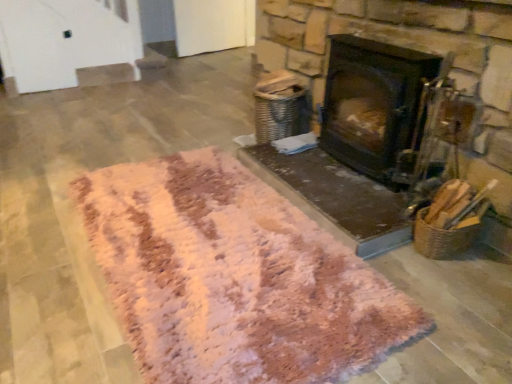
The image size is (512, 384). Describe the element at coordinates (376, 107) in the screenshot. I see `black matte wood burning stove at center` at that location.

Find the location of a particular element. Image resolution: width=512 pixels, height=384 pixels. black matte wood burning stove at center is located at coordinates (376, 107).

This screenshot has width=512, height=384. What do you see at coordinates (234, 277) in the screenshot? I see `pink shaggy rug at center` at bounding box center [234, 277].

The image size is (512, 384). In order to click on pink shaggy rug at center in this screenshot , I will do `click(234, 277)`.

This screenshot has width=512, height=384. What are the coordinates of `black matte wood burning stove at center` in the screenshot? It's located at (376, 107).

Considering the positions of objects black matte wood burning stove at center and pink shaggy rug at center in the image provided, who is more to the left, black matte wood burning stove at center or pink shaggy rug at center?

pink shaggy rug at center is more to the left.

Does black matte wood burning stove at center lie in front of pink shaggy rug at center?

No, it is not.

Between point (359, 116) and point (192, 265), which one is positioned behind?

Positioned behind is point (359, 116).

From the image's perspective, is black matte wood burning stove at center positioned above or below pink shaggy rug at center?

black matte wood burning stove at center is situated higher than pink shaggy rug at center in the image.

From a real-world perspective, is black matte wood burning stove at center physically located above or below pink shaggy rug at center?

Clearly, from a real-world perspective, black matte wood burning stove at center is above pink shaggy rug at center.

Can you confirm if black matte wood burning stove at center is thinner than pink shaggy rug at center?

Yes.

Is black matte wood burning stove at center taller or shorter than pink shaggy rug at center?

black matte wood burning stove at center is taller than pink shaggy rug at center.

Consider the image. Is black matte wood burning stove at center bigger than pink shaggy rug at center?

Actually, black matte wood burning stove at center might be smaller than pink shaggy rug at center.

Is black matte wood burning stove at center inside the boundaries of pink shaggy rug at center, or outside?

black matte wood burning stove at center is not enclosed by pink shaggy rug at center.

Can you see black matte wood burning stove at center touching pink shaggy rug at center?

No.

Is black matte wood burning stove at center oriented away from pink shaggy rug at center?

black matte wood burning stove at center is not turned away from pink shaggy rug at center.

In the scene shown: How different are the orientations of black matte wood burning stove at center and pink shaggy rug at center in degrees?

2.32 degrees separate the facing orientations of black matte wood burning stove at center and pink shaggy rug at center.

How distant is black matte wood burning stove at center from pink shaggy rug at center?

28.52 inches.

You are a GUI agent. You are given a task and a screenshot of the screen. Output one action in this format:
    pyautogui.click(x=<x>, y=<y>)
    Task: Click on the wood burning stove behind the pink shaggy rug at center
    The width and height of the screenshot is (512, 384).
    Given the screenshot: What is the action you would take?
    pos(376,107)

Is pink shaggy rug at center at the right side of black matte wood burning stove at center?

No, pink shaggy rug at center is not to the right of black matte wood burning stove at center.

Which object is closer to the camera, pink shaggy rug at center or black matte wood burning stove at center?

pink shaggy rug at center is in front.

Which point is more distant from viewer, (266, 256) or (381, 123)?

The point (381, 123) is farther.

From the image's perspective, would you say pink shaggy rug at center is shown under black matte wood burning stove at center?

Yes.

Based on the photo, from a real-world perspective, is pink shaggy rug at center positioned above or below black matte wood burning stove at center?

pink shaggy rug at center is situated lower than black matte wood burning stove at center in the real world.

Does pink shaggy rug at center have a greater width compared to black matte wood burning stove at center?

Correct, the width of pink shaggy rug at center exceeds that of black matte wood burning stove at center.

Which of these two, pink shaggy rug at center or black matte wood burning stove at center, stands shorter?

Standing shorter between the two is pink shaggy rug at center.

Considering the sizes of objects pink shaggy rug at center and black matte wood burning stove at center in the image provided, who is smaller, pink shaggy rug at center or black matte wood burning stove at center?

black matte wood burning stove at center is smaller.

Is pink shaggy rug at center not within black matte wood burning stove at center?

That's correct, pink shaggy rug at center is outside of black matte wood burning stove at center.

Consider the image. Are pink shaggy rug at center and black matte wood burning stove at center making contact?

pink shaggy rug at center is not next to black matte wood burning stove at center, and they're not touching.

Could you tell me if pink shaggy rug at center is facing black matte wood burning stove at center?

No, pink shaggy rug at center is not aimed at black matte wood burning stove at center.

In order to click on wood burning stove above the pink shaggy rug at center (from a real-world perspective) in this screenshot , I will do `click(376, 107)`.

Image resolution: width=512 pixels, height=384 pixels. In order to click on wood burning stove behind the pink shaggy rug at center in this screenshot , I will do `click(376, 107)`.

Locate an element on the screen. wood burning stove on the right of the pink shaggy rug at center is located at coordinates (376, 107).